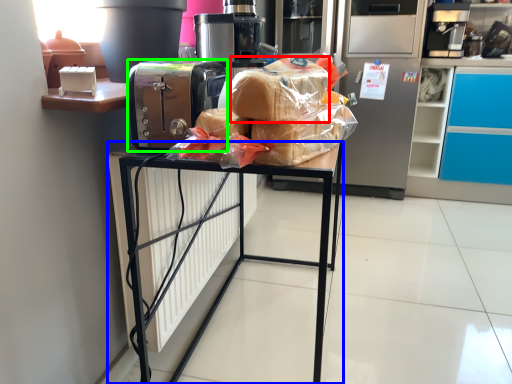
Question: Based on their relative distances, which object is farther from bread (highlighted by a red box)? Choose from furniture (highlighted by a blue box) and home appliance (highlighted by a green box).

Choices:
 (A) furniture
 (B) home appliance

Answer: (A)